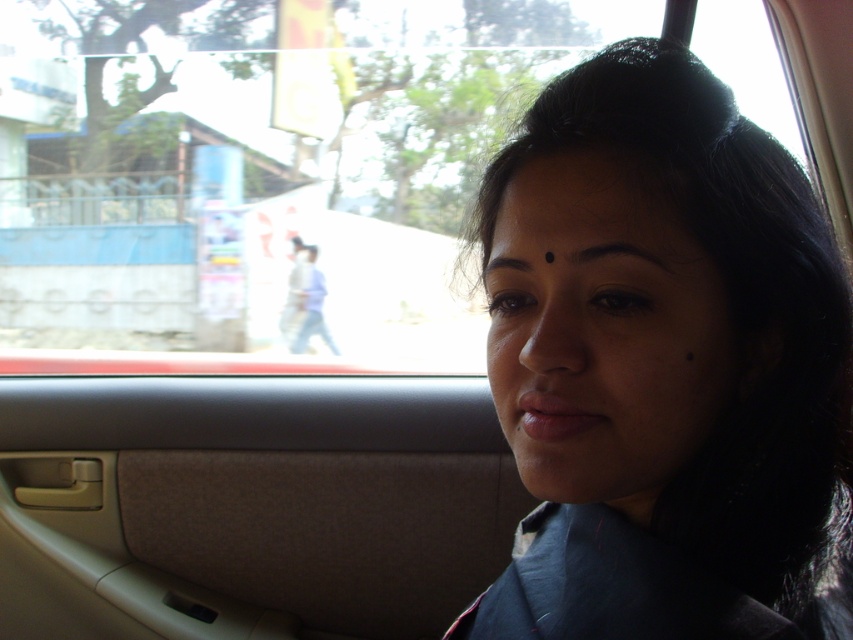
Which is more to the right, dark blue fabric at center or black smooth forehead at upper center?

Positioned to the right is dark blue fabric at center.

Consider the image. Between dark blue fabric at center and black smooth forehead at upper center, which one appears on the left side from the viewer's perspective?

Positioned to the left is black smooth forehead at upper center.

Identify the location of dark blue fabric at center. The height and width of the screenshot is (640, 853). (665, 365).

Locate an element on the screen. dark blue fabric at center is located at coordinates (665, 365).